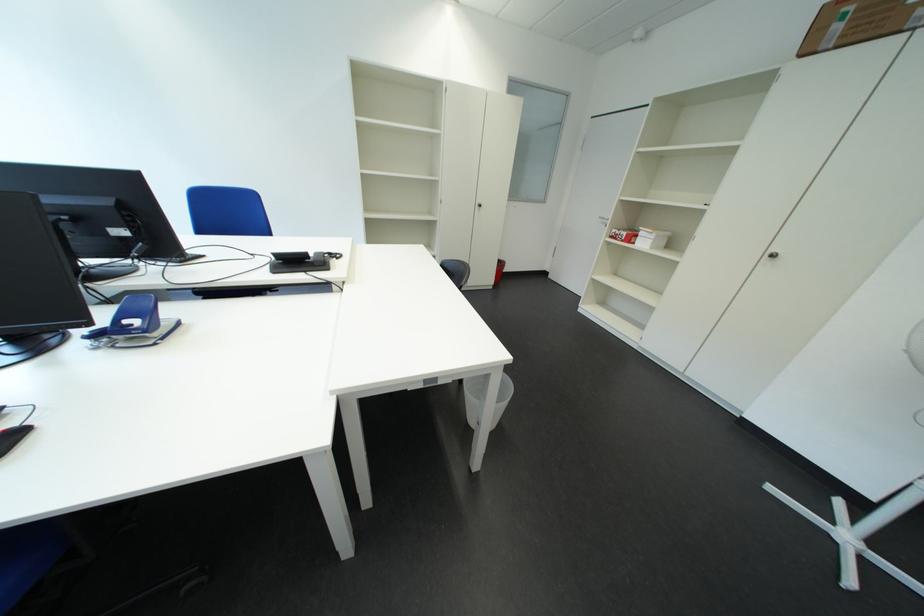
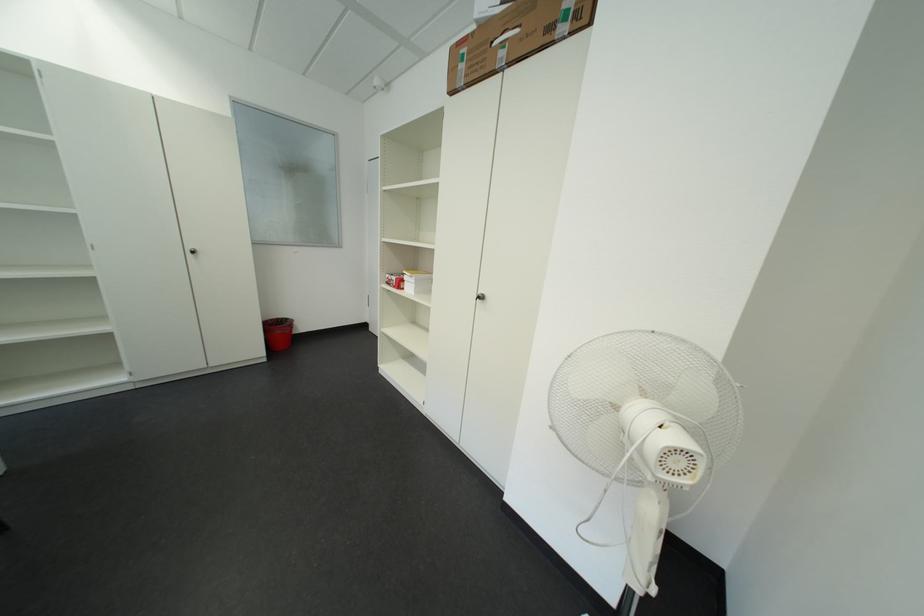
In the second image, find the point that corresponds to (x=643, y=241) in the first image.

(411, 286)